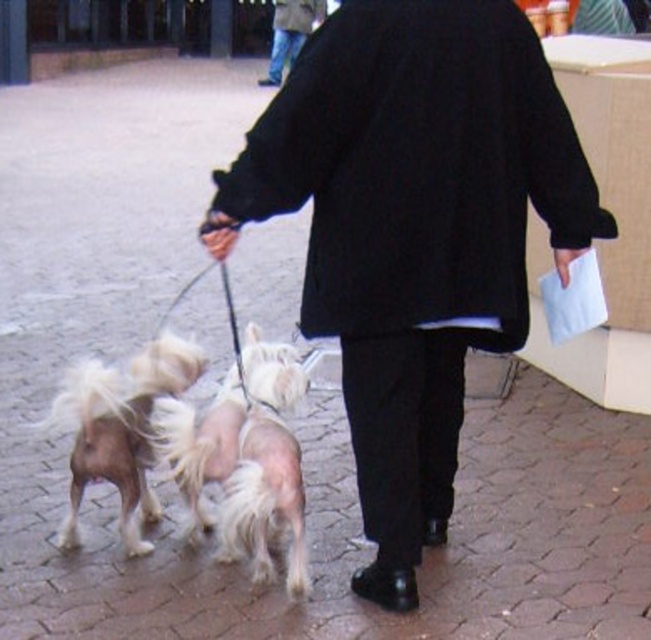
You are a photographer trying to capture a clear shot of the person and their dogs. The shiny white fur at center and the black wool coat at upper center are both in your viewfinder. Since you want to focus on the person, which object should you adjust your focus to prioritize, considering their sizes?

The shiny white fur at center is smaller in width than the black wool coat at upper center, so you should prioritize focusing on the black wool coat at upper center to ensure the person is the main subject.

You are a delivery robot navigating through the urban area shown. You need to deliver a package to the person holding the light blue object in their left hand. There are two dogs with shiny white fur at center and shiny golden fur at center in your path. What is the minimum distance you should maintain between the dogs to safely pass through?

The minimum distance to maintain between the shiny white fur at center and shiny golden fur at center is 7.55 inches to safely pass through.

You are a drone operator trying to capture a photo of the shiny white fur at center and the black wool coat at upper center. The minimum distance between the two objects must be maintained in the photo. What is the minimum distance you should set for the drone to ensure both objects are in frame?

The minimum distance to set is 12.44 meters because the shiny white fur at center is 12.44 meters away from the black wool coat at upper center, so the drone needs to be at least that distance away to capture both in the photo.